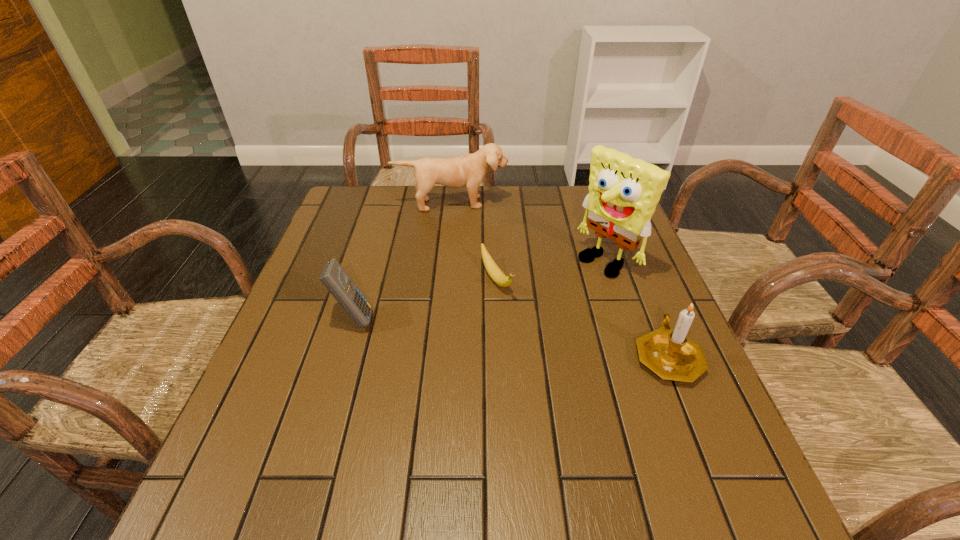
Locate an element on the screen. The image size is (960, 540). free location that satisfies the following two spatial constraints: 1. on the front side of the puppy; 2. on the right side of the tallest object is located at coordinates (446, 261).